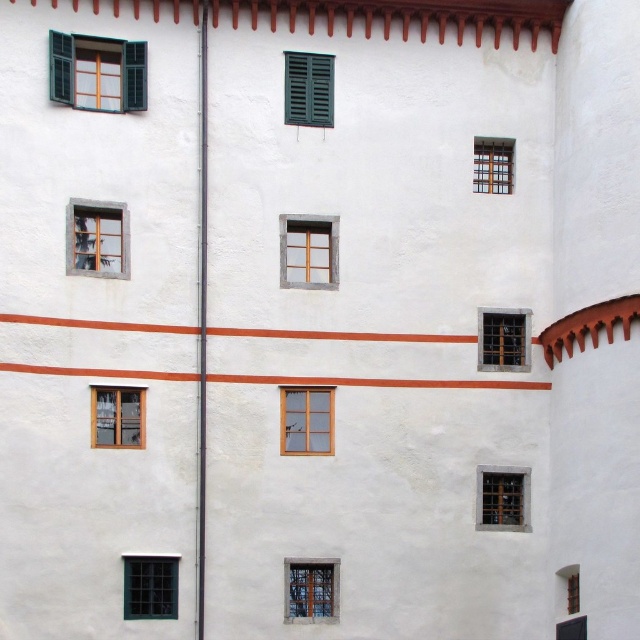
You are an architect inspecting the building facade. You notice the green matte shutters at upper left and the transparent glass window at upper left. Which object is located more to the left side of the wall?

The green matte shutters at upper left is positioned on the left side of transparent glass window at upper left, so it is more to the left.

You are a window installer measuring distances between windows for a new project. You need to ensure that the distance between the matte glass window at lower right and the clear glass window at center is at least 7 meters. Based on the image, is this requirement met?

The distance between the matte glass window at lower right and the clear glass window at center is 8.08 meters, which exceeds the required 7 meters. Therefore, the requirement is met.